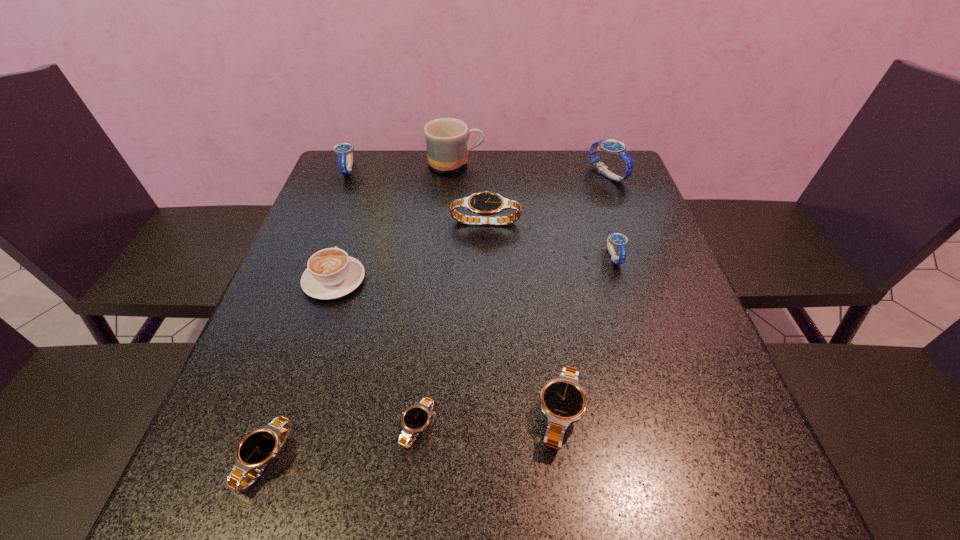
Identify the location of empty location between the second biggest blue watch and the biggest black watch. The width and height of the screenshot is (960, 540). (417, 195).

Identify the location of free space that is in between the leftmost blue watch and the white cappuccino. (342, 225).

I want to click on unoccupied area between the third smallest black watch and the fifth nearest watch, so click(522, 318).

Identify the location of free point between the white cappuccino and the nearest blue watch. This screenshot has height=540, width=960. pos(473,268).

The height and width of the screenshot is (540, 960). I want to click on empty location between the second biggest blue watch and the cappuccino, so click(342, 225).

Choose which object is the third nearest neighbor to the white cappuccino. Please provide its 2D coordinates. Your answer should be formatted as a tuple, i.e. [(x, y)], where the tuple contains the x and y coordinates of a point satisfying the conditions above.

[(256, 450)]

Where is `object that can be found as the third closest to the nearest blue watch`? Image resolution: width=960 pixels, height=540 pixels. object that can be found as the third closest to the nearest blue watch is located at coordinates click(563, 401).

The image size is (960, 540). Find the location of `watch object that ranks as the sixth closest to the white cappuccino`. watch object that ranks as the sixth closest to the white cappuccino is located at coordinates click(x=619, y=240).

The height and width of the screenshot is (540, 960). Find the location of `the sixth closest watch to the mug`. the sixth closest watch to the mug is located at coordinates (416, 418).

Locate an element on the screen. The image size is (960, 540). blue watch that stands as the second closest to the mug is located at coordinates (614, 147).